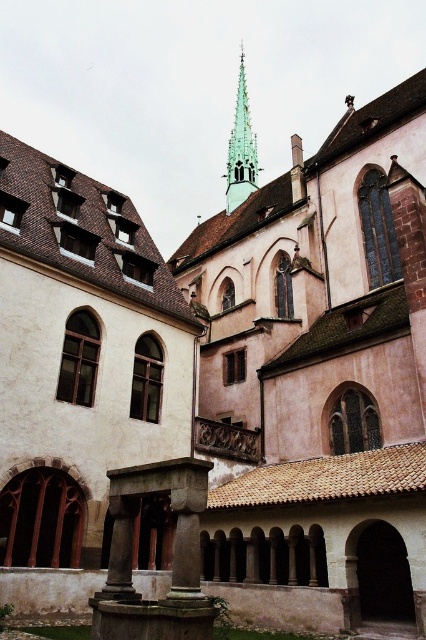
Question: Which point appears closest to the camera in this image?

Choices:
 (A) (127, 612)
 (B) (245, 116)

Answer: (A)

Question: Which object is farther from the camera taking this photo?

Choices:
 (A) green glass spire at upper center
 (B) green stone fountain at lower center

Answer: (A)

Question: Is green stone fountain at lower center to the right of green glass spire at upper center from the viewer's perspective?

Choices:
 (A) no
 (B) yes

Answer: (A)

Question: Which object is farther from the camera taking this photo?

Choices:
 (A) green stone fountain at lower center
 (B) green glass spire at upper center

Answer: (B)

Question: Can you confirm if green stone fountain at lower center is positioned above green glass spire at upper center?

Choices:
 (A) yes
 (B) no

Answer: (B)

Question: Is green stone fountain at lower center positioned at the back of green glass spire at upper center?

Choices:
 (A) yes
 (B) no

Answer: (B)